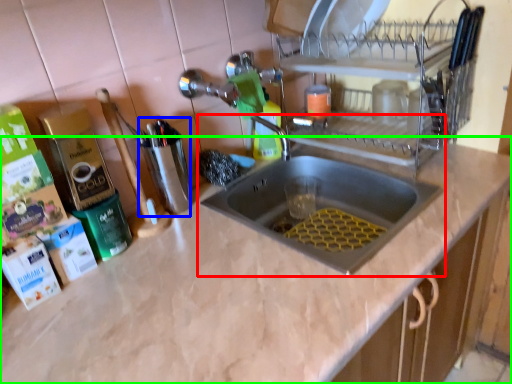
Question: Considering the real-world distances, which object is farthest from sink (highlighted by a red box)? appliance (highlighted by a blue box) or countertop (highlighted by a green box)?

Choices:
 (A) appliance
 (B) countertop

Answer: (A)